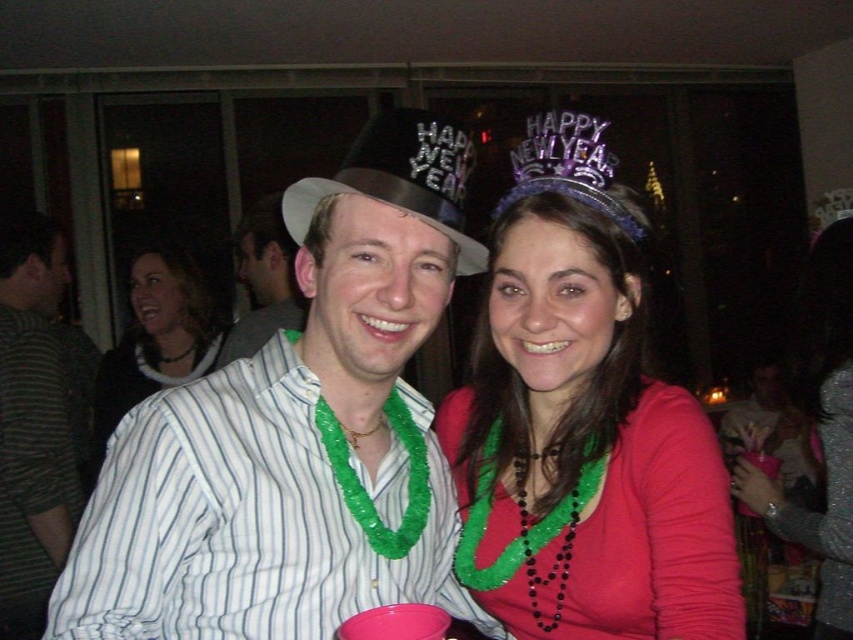
You are at a New Year party and want to know if the purple glittery tiara at upper center can fit inside a gift box that is the same height as the white striped shirt at center. Can it fit?

The purple glittery tiara at upper center is not as tall as the white striped shirt at center, so it can fit inside the gift box that matches the shirt height.

You are at a New Year party and see the purple glittery tiara at upper center and the white striped shirt at center. Which one is positioned higher?

The purple glittery tiara at upper center is positioned higher than the white striped shirt at center.